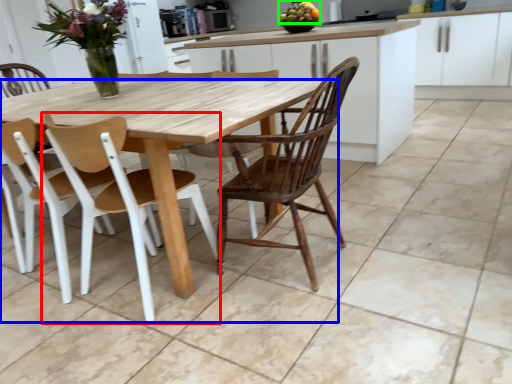
Question: Based on their relative distances, which object is farther from chair (highlighted by a red box)? Choose from table (highlighted by a blue box) and fruit (highlighted by a green box).

Choices:
 (A) table
 (B) fruit

Answer: (B)